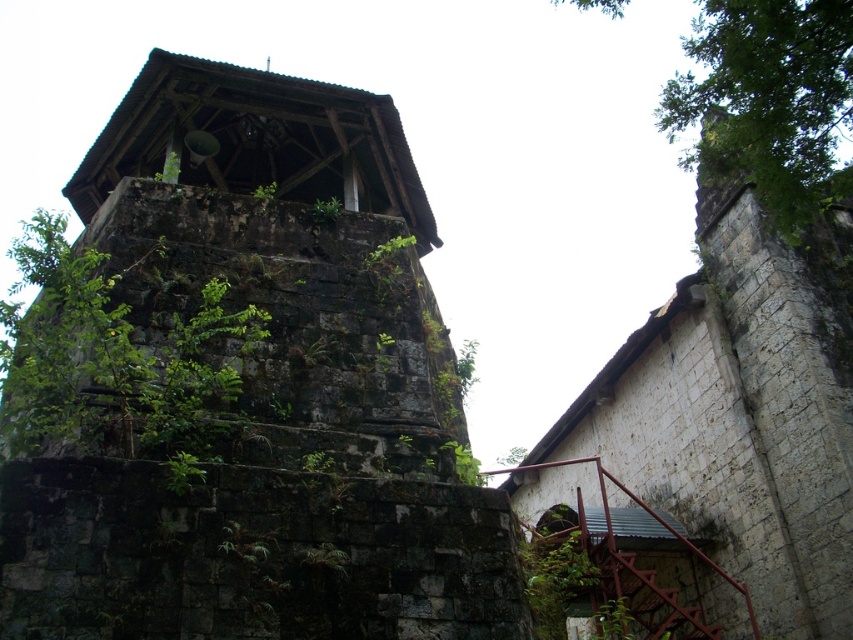
Who is shorter, dark stone tower at center or green leafy tree at upper right?

With less height is dark stone tower at center.

Is point (242, 426) in front of point (683, 93)?

That is True.

The height and width of the screenshot is (640, 853). Identify the location of dark stone tower at center. (270, 392).